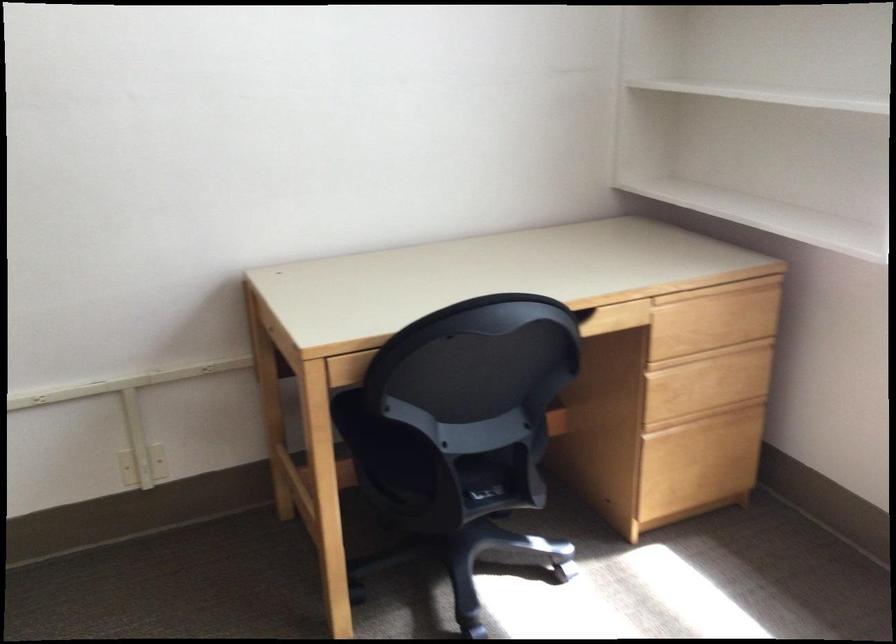
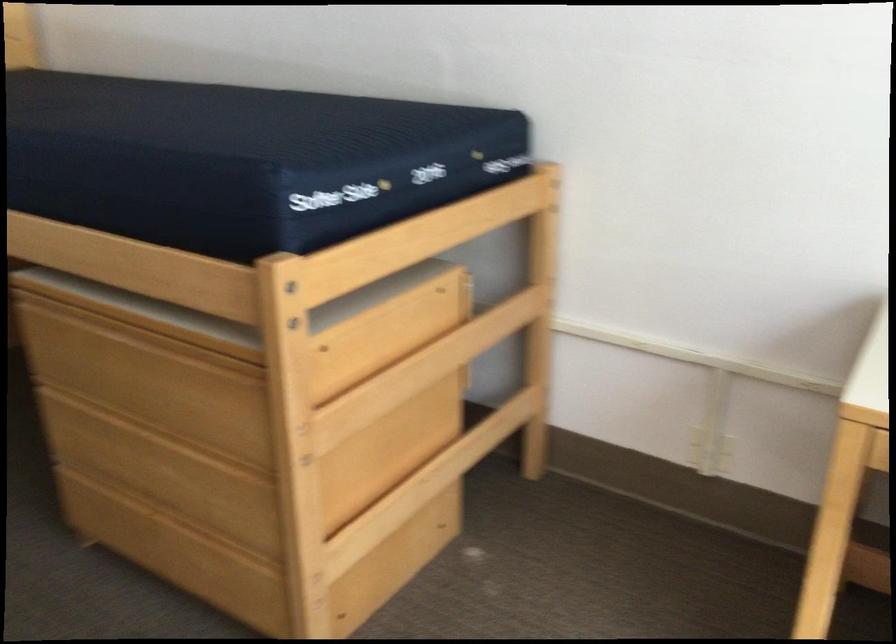
Question: How did the camera likely rotate?

Choices:
 (A) Left
 (B) Right
 (C) Up
 (D) Down

Answer: (A)